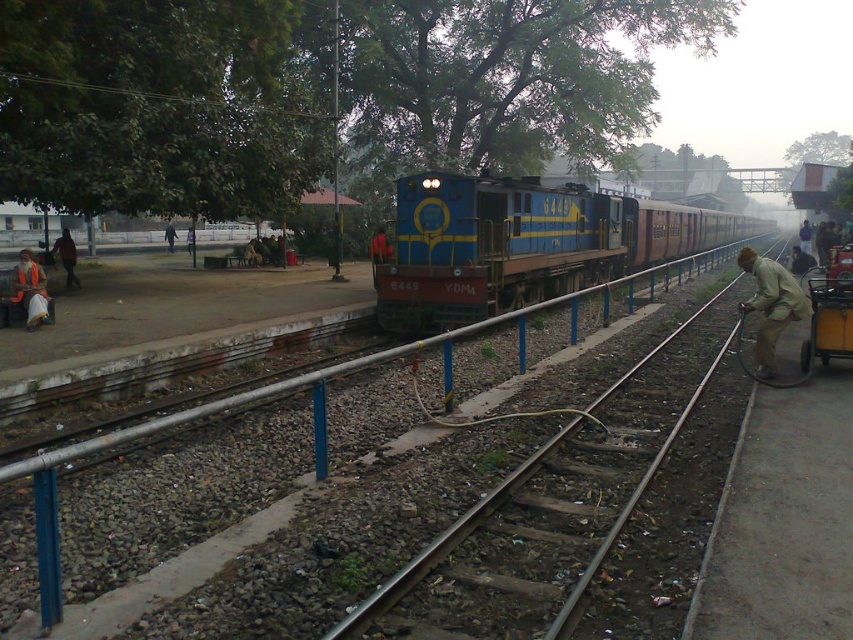
Can you confirm if blue painted metal train track at center is wider than light brown fabric at lower left?

Correct, the width of blue painted metal train track at center exceeds that of light brown fabric at lower left.

I want to click on blue painted metal train track at center, so click(196, 474).

Is point (27, 280) in front of point (376, 250)?

Yes.

Is light brown fabric at lower left wider than red fabric bag at center?

No, light brown fabric at lower left is not wider than red fabric bag at center.

You are a GUI agent. You are given a task and a screenshot of the screen. Output one action in this format:
    pyautogui.click(x=<x>, y=<y>)
    Task: Click on the light brown fabric at lower left
    The height and width of the screenshot is (640, 853).
    Given the screenshot: What is the action you would take?
    pyautogui.click(x=30, y=291)

Does dark brown leather jacket at left appear on the right side of brown fabric cart at right?

No, dark brown leather jacket at left is not to the right of brown fabric cart at right.

Can you confirm if dark brown leather jacket at left is positioned to the left of brown fabric cart at right?

Yes, dark brown leather jacket at left is to the left of brown fabric cart at right.

I want to click on dark brown leather jacket at left, so coord(67,257).